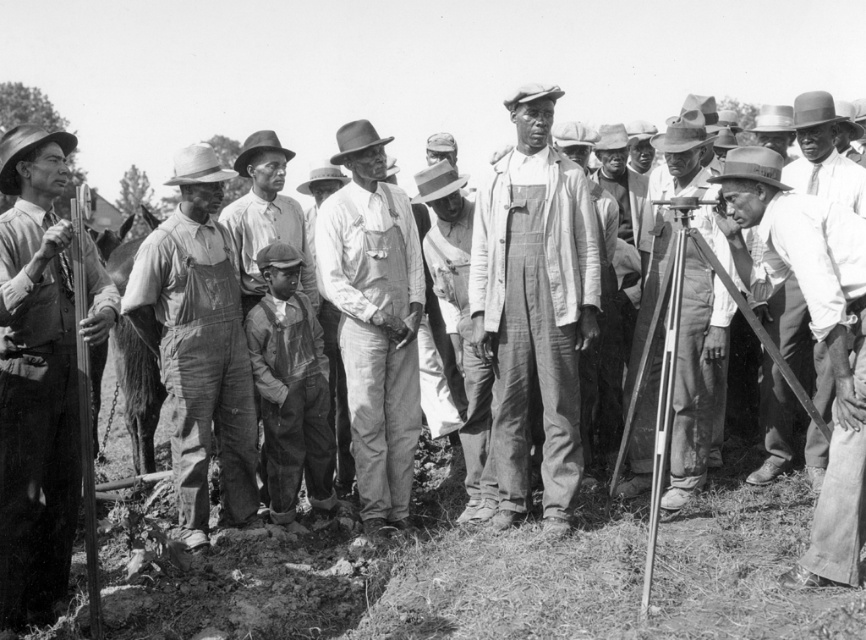
You are a photographer standing near the camera. You want to adjust the matte overalls at center so that it is closer to the camera. How much distance do you need to move it towards the camera to make it 1.5 meters away from the camera?

The matte overalls at center is currently 5.83 meters away from the camera. To make it 1.5 meters away, you need to move it closer by 5.83 minus 1.5 equals 4.33 meters.

You are a photographer analyzing the image. You notice the rough denim overalls at center and the smooth leather hat at center. Which object is covering part of the other?

The rough denim overalls at center is positioned over the smooth leather hat at center, so the overalls are covering part of the hat.

Consider the image. You are a photographer carrying a camera that requires a tripod. You see the matte overalls at center and the smooth wood tripod at center in the image. Which object is more suitable for placing your camera?

The smooth wood tripod at center is more suitable for placing your camera since it is larger in size compared to the matte overalls at center.